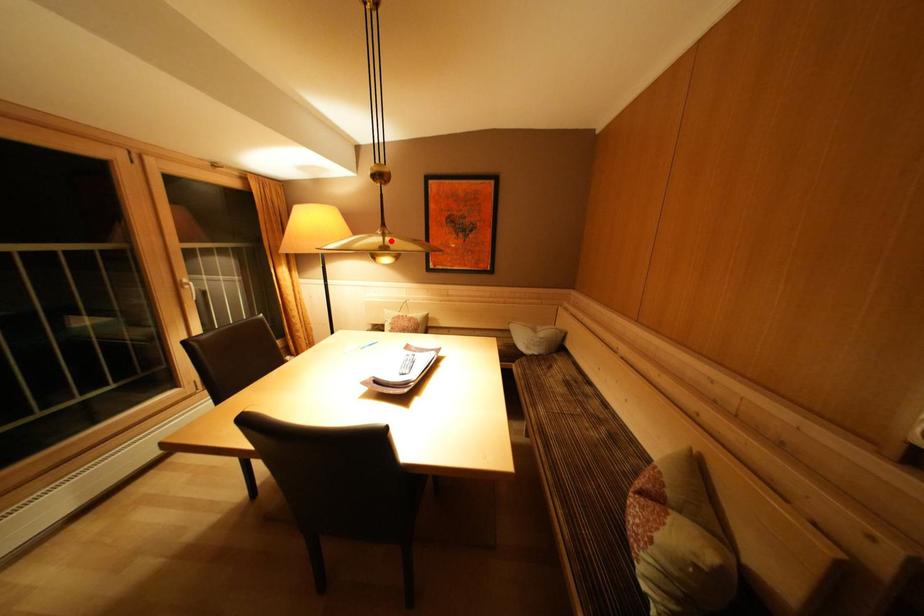
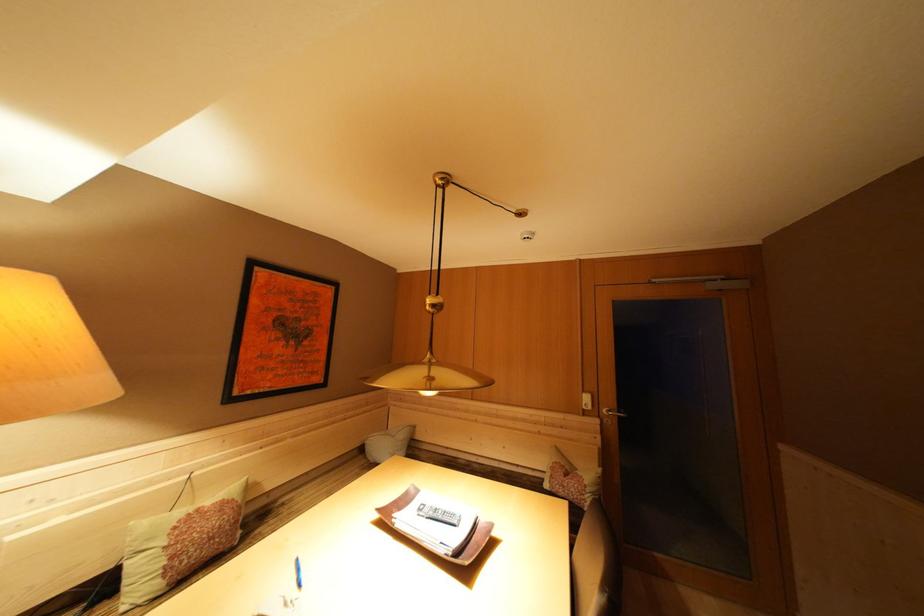
Find the pixel in the second image that matches the highlighted location in the first image.

(438, 369)